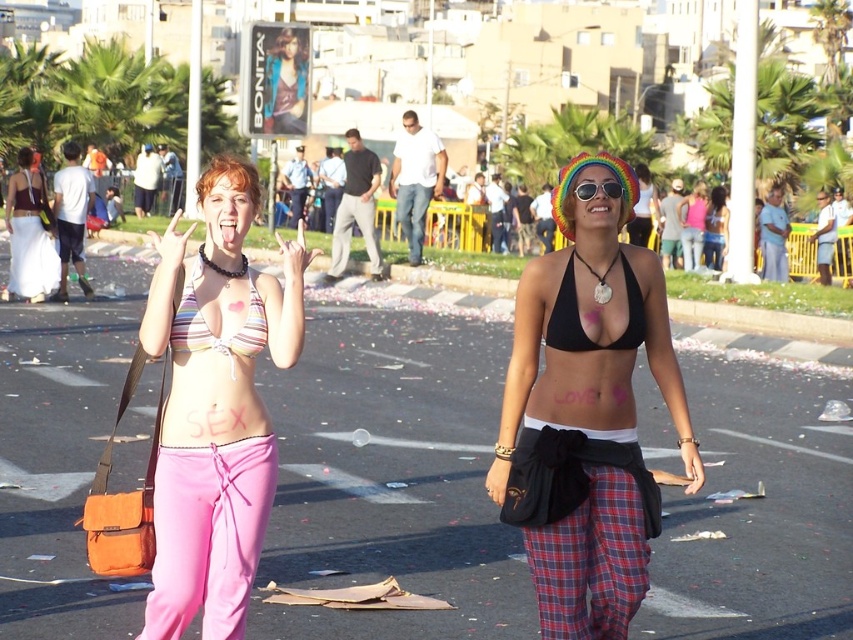
Describe the element at coordinates (230, 177) in the screenshot. I see `blonde hair at center` at that location.

Is blonde hair at center thinner than multicolored plastic goggles at center?

No.

Who is more distant from viewer, (209, 179) or (596, 186)?

Point (209, 179)

You are a GUI agent. You are given a task and a screenshot of the screen. Output one action in this format:
    pyautogui.click(x=<x>, y=<y>)
    Task: Click on the blonde hair at center
    This screenshot has width=853, height=640.
    Given the screenshot: What is the action you would take?
    pyautogui.click(x=230, y=177)

Which is in front, point (189, 556) or point (712, 259)?

Positioned in front is point (189, 556).

Which is below, striped bikini top at center or matte black bikini top at center?

striped bikini top at center is below.

Does point (230, 243) lie behind point (721, 212)?

No.

I want to click on striped bikini top at center, so click(215, 413).

Is striped bikini top at center wider than multicolored fabric bikini top at center?

Yes, striped bikini top at center is wider than multicolored fabric bikini top at center.

Between striped bikini top at center and multicolored fabric bikini top at center, which one has more height?

Standing taller between the two is striped bikini top at center.

Image resolution: width=853 pixels, height=640 pixels. What are the coordinates of `striped bikini top at center` in the screenshot? It's located at (215, 413).

The width and height of the screenshot is (853, 640). In order to click on striped bikini top at center in this screenshot , I will do `click(215, 413)`.